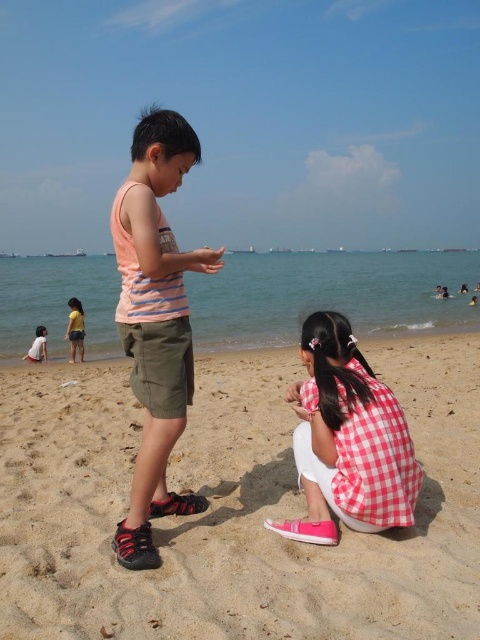
Question: Which point appears farthest from the camera in this image?

Choices:
 (A) (36, 340)
 (B) (74, 317)

Answer: (B)

Question: Does sandy beach at center have a lesser width compared to yellow cotton shirt at lower left?

Choices:
 (A) no
 (B) yes

Answer: (A)

Question: Which of these objects is positioned closest to the sandy beach at center?

Choices:
 (A) white cotton shirt at lower left
 (B) yellow cotton shirt at lower left
 (C) matte orange tank top at center
 (D) red checkered shirt at lower center

Answer: (D)

Question: Is red checkered shirt at lower center to the right of white cotton shirt at lower left from the viewer's perspective?

Choices:
 (A) no
 (B) yes

Answer: (B)

Question: Is sandy beach at center thinner than white cotton shirt at lower left?

Choices:
 (A) yes
 (B) no

Answer: (B)

Question: Which of the following is the closest to the observer?

Choices:
 (A) (36, 326)
 (B) (402, 500)
 (C) (177, 186)

Answer: (B)